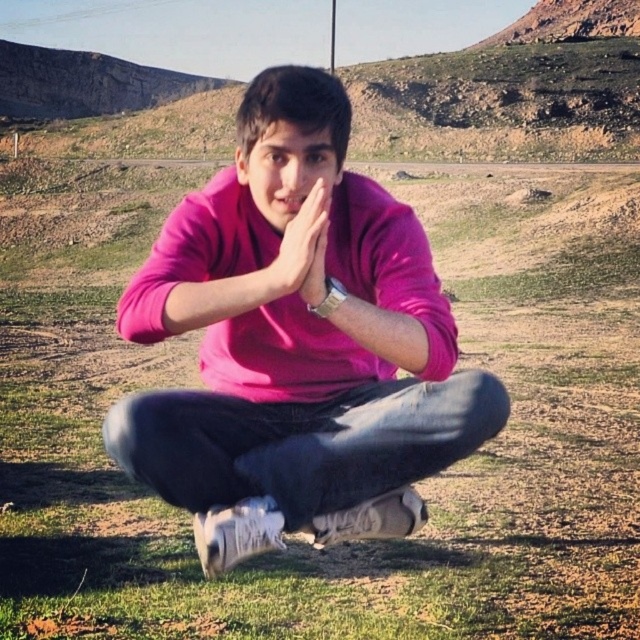
Question: Is green grass at center thinner than pink matte hands at center?

Choices:
 (A) no
 (B) yes

Answer: (A)

Question: Which point appears farthest from the camera in this image?

Choices:
 (A) (621, 614)
 (B) (252, 164)
 (C) (291, 228)

Answer: (A)

Question: Among these objects, which one is farthest from the camera?

Choices:
 (A) pink matte sweater at center
 (B) pink matte hands at center

Answer: (A)

Question: Which object appears closest to the camera in this image?

Choices:
 (A) pink matte hands at center
 (B) pink matte sweater at center

Answer: (A)

Question: Is green grass at center smaller than pink matte sweater at center?

Choices:
 (A) no
 (B) yes

Answer: (A)

Question: Does green grass at center come behind pink matte hands at center?

Choices:
 (A) yes
 (B) no

Answer: (A)